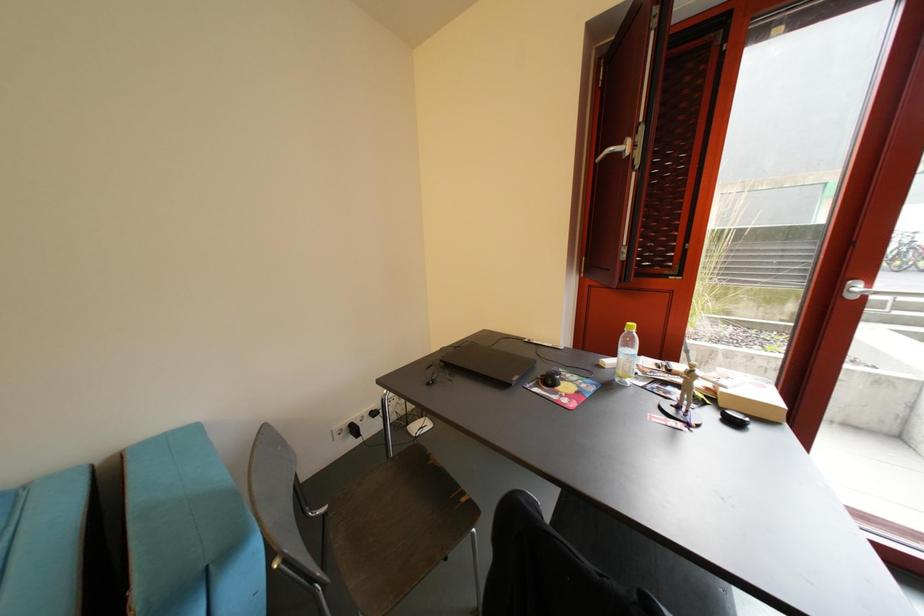
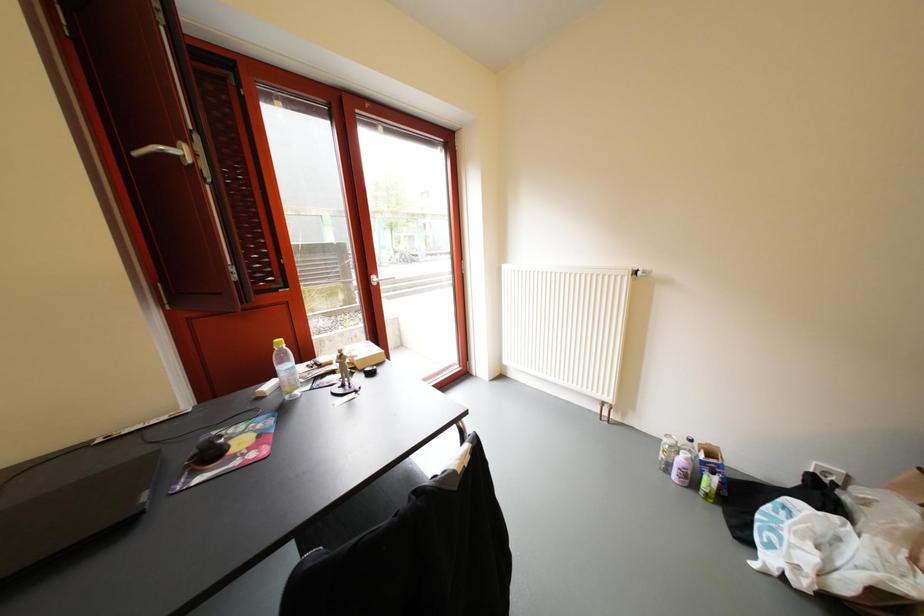
Question: The camera is either moving clockwise (left) or counter-clockwise (right) around the object. The first image is from the beginning of the video and the second image is from the end. Is the camera moving left or right when shooting the video?

Choices:
 (A) Left
 (B) Right

Answer: (A)